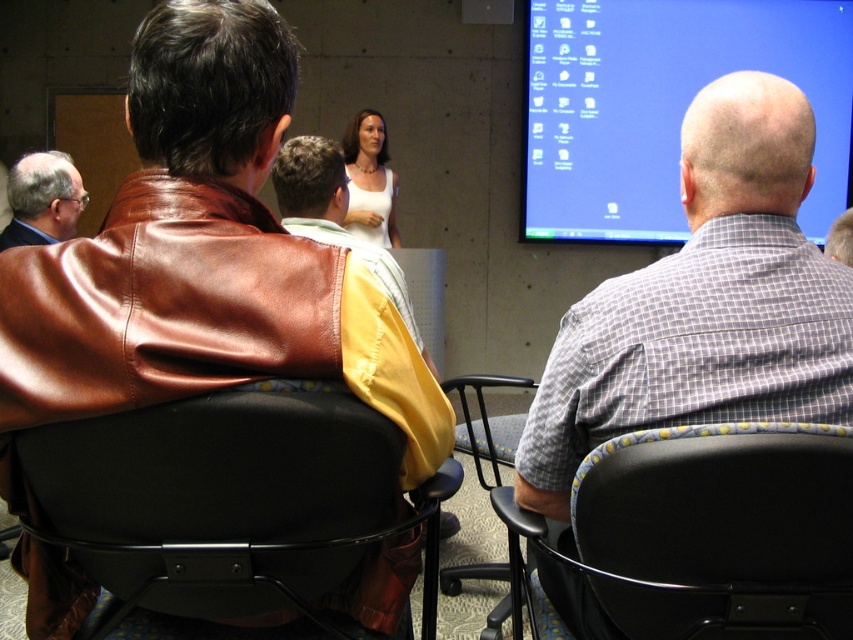
Is matte brown leather jacket at left positioned before white matte dress at center?

Yes, it is.

Between matte brown leather jacket at left and white matte dress at center, which one appears on the left side from the viewer's perspective?

matte brown leather jacket at left is more to the left.

Is point (48, 161) positioned before point (363, 234)?

Yes.

Identify the location of matte brown leather jacket at left. The image size is (853, 640). (42, 198).

Which of these two, black plastic chair at center or gray checkered shirt at upper right, stands taller?

black plastic chair at center is taller.

Is point (492, 486) closer to camera compared to point (840, 220)?

No, it is behind (840, 220).

Find the location of `black plastic chair at center`. black plastic chair at center is located at coordinates (486, 424).

Which is behind, point (119, 493) or point (498, 573)?

Point (498, 573)

Does black leather chair at lower left come behind black plastic chair at center?

No, it is in front of black plastic chair at center.

Which is in front, point (59, 461) or point (451, 589)?

Point (59, 461) is more forward.

You are a GUI agent. You are given a task and a screenshot of the screen. Output one action in this format:
    pyautogui.click(x=<x>, y=<y>)
    Task: Click on the black leather chair at lower left
    The width and height of the screenshot is (853, 640).
    Given the screenshot: What is the action you would take?
    pyautogui.click(x=231, y=508)